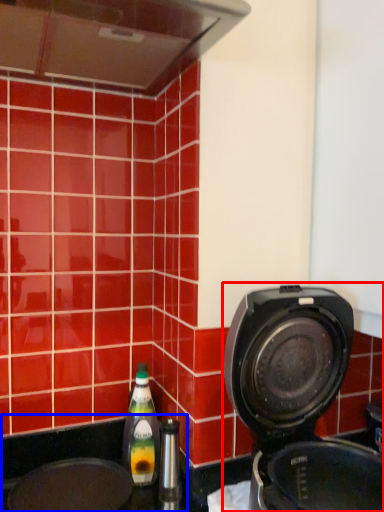
Question: Which of the following is the closest to the observer, home appliance (highlighted by a red box) or sink (highlighted by a blue box)?

Choices:
 (A) home appliance
 (B) sink

Answer: (A)